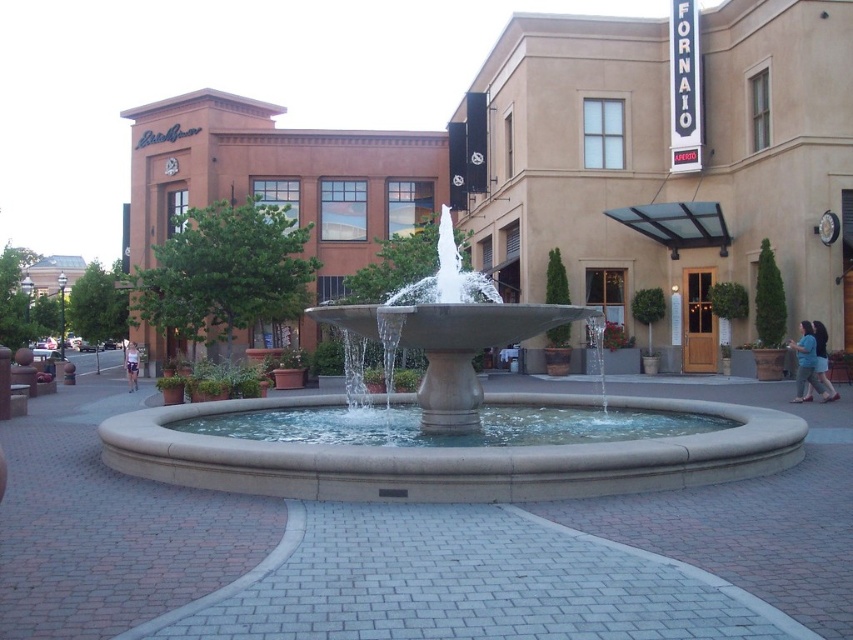
Question: Which of the following is the closest to the observer?

Choices:
 (A) denim shorts at center
 (B) denim skirt at lower right
 (C) blue cotton shirt at lower right
 (D) smooth concrete fountain at center

Answer: (D)

Question: Observing the image, what is the correct spatial positioning of blue cotton shirt at lower right in reference to denim skirt at lower right?

Choices:
 (A) right
 (B) left

Answer: (B)

Question: Observing the image, what is the correct spatial positioning of blue cotton shirt at lower right in reference to denim skirt at lower right?

Choices:
 (A) left
 (B) right

Answer: (A)

Question: Which point is farther to the camera?

Choices:
 (A) (740, 448)
 (B) (811, 324)
 (C) (129, 378)
 (D) (820, 362)

Answer: (C)

Question: Which object is positioned farthest from the denim skirt at lower right?

Choices:
 (A) smooth concrete fountain at center
 (B) blue cotton shirt at lower right

Answer: (A)

Question: Is blue cotton shirt at lower right to the left of denim skirt at lower right from the viewer's perspective?

Choices:
 (A) no
 (B) yes

Answer: (B)